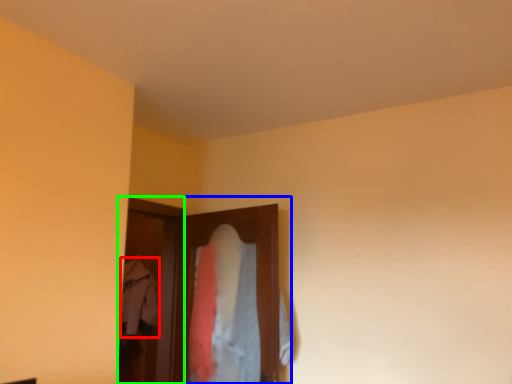
Question: Which is nearer to the clothing (highlighted by a red box)? closet (highlighted by a blue box) or screen door (highlighted by a green box).

Choices:
 (A) closet
 (B) screen door

Answer: (B)